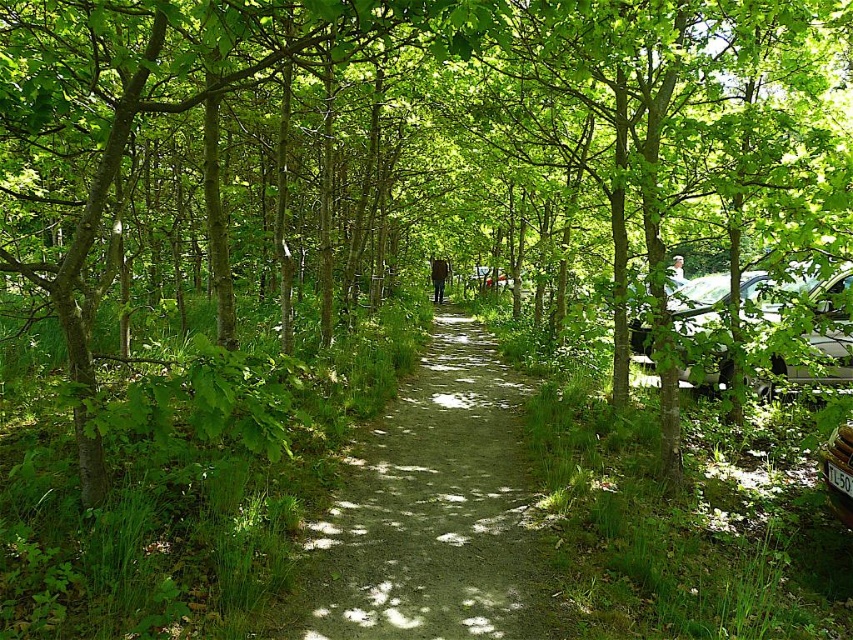
Does dirt path at center appear on the left side of metallic silver car at right?

Indeed, dirt path at center is positioned on the left side of metallic silver car at right.

Can you confirm if dirt path at center is taller than metallic silver car at right?

In fact, dirt path at center may be shorter than metallic silver car at right.

Which is in front, point (549, 637) or point (846, 422)?

Point (549, 637) is more forward.

At what (x,y) coordinates should I click in order to perform the action: click on dirt path at center. Please return your answer as a coordinate pair (x, y). Image resolution: width=853 pixels, height=640 pixels. Looking at the image, I should click on (432, 509).

I want to click on silver metallic car at right, so click(814, 317).

The width and height of the screenshot is (853, 640). Describe the element at coordinates (814, 317) in the screenshot. I see `silver metallic car at right` at that location.

Between point (711, 381) and point (824, 445), which one is positioned in front?

Positioned in front is point (824, 445).

Image resolution: width=853 pixels, height=640 pixels. What are the coordinates of `silver metallic car at right` in the screenshot? It's located at (814, 317).

Does dirt path at center have a lesser height compared to silver metallic car at right?

Yes, dirt path at center is shorter than silver metallic car at right.

Image resolution: width=853 pixels, height=640 pixels. What do you see at coordinates (432, 509) in the screenshot?
I see `dirt path at center` at bounding box center [432, 509].

This screenshot has height=640, width=853. In order to click on dirt path at center in this screenshot , I will do `click(432, 509)`.